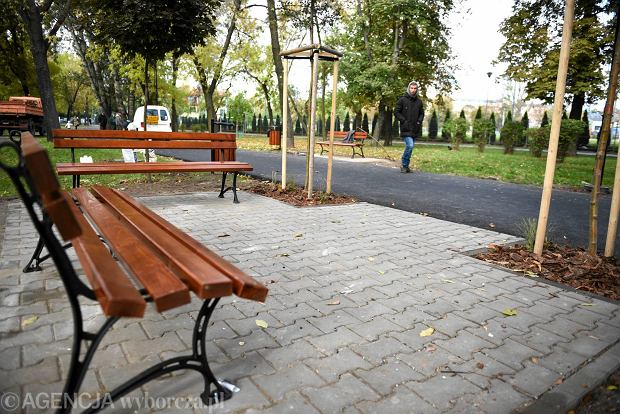
You are a GUI agent. You are given a task and a screenshot of the screen. Output one action in this format:
    pyautogui.click(x=<x>, y=<y>)
    Task: Click on the window
    The width and height of the screenshot is (620, 414).
    Given the screenshot: What is the action you would take?
    (x=164, y=114)